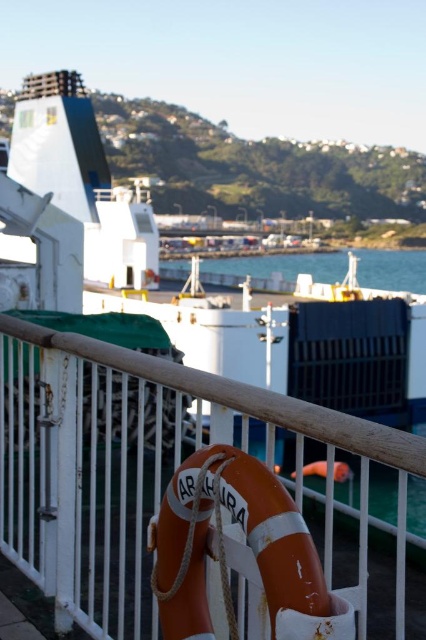
Is white metal fence at center taller than orange matte life jacket at center?

Yes, white metal fence at center is taller than orange matte life jacket at center.

The image size is (426, 640). Find the location of `white metal fence at center`. white metal fence at center is located at coordinates (175, 496).

Which is behind, point (293, 499) or point (268, 257)?

Positioned behind is point (268, 257).

Does white metal fence at center appear under blue water at center?

Yes, white metal fence at center is below blue water at center.

Locate an element on the screen. This screenshot has width=426, height=640. white metal fence at center is located at coordinates (175, 496).

Locate an element on the screen. This screenshot has height=640, width=426. white metal fence at center is located at coordinates (175, 496).

This screenshot has width=426, height=640. What do you see at coordinates (245, 544) in the screenshot?
I see `orange matte life jacket at center` at bounding box center [245, 544].

Between point (175, 554) and point (333, 276), which one is positioned behind?

The point (333, 276) is behind.

Describe the element at coordinates (245, 544) in the screenshot. This screenshot has height=640, width=426. I see `orange matte life jacket at center` at that location.

Find the location of a particular element. orange matte life jacket at center is located at coordinates (245, 544).